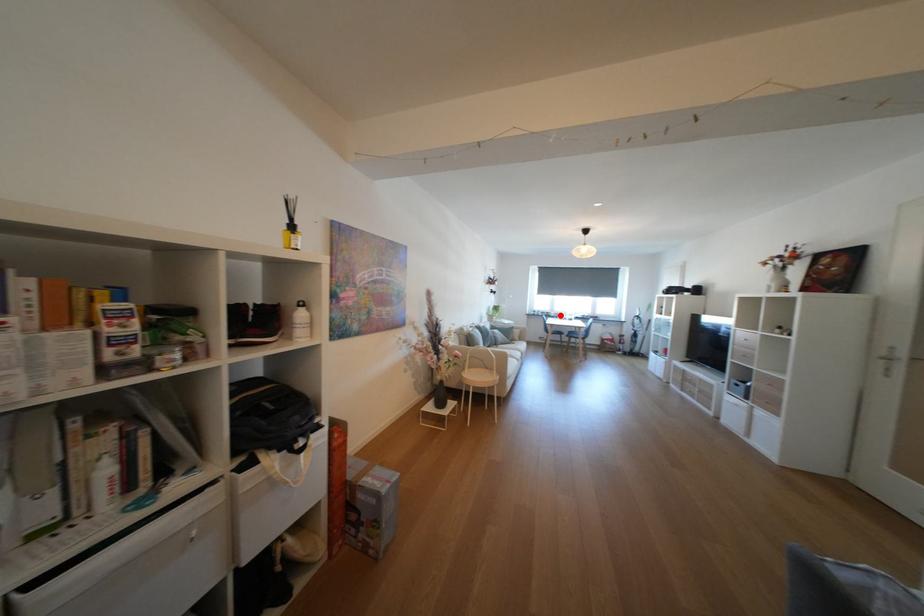
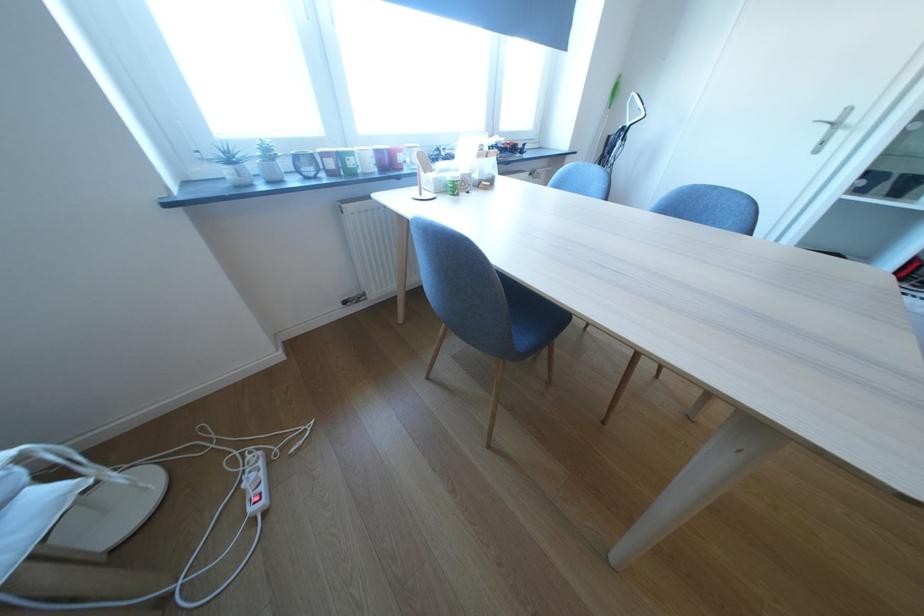
Question: A red point is marked in image1. In image2, is the corresponding 3D point closer to the camera or farther? Reply with the corresponding letter.

Choices:
 (A) The corresponding 3D point is closer.
 (B) The corresponding 3D point is farther.

Answer: (A)